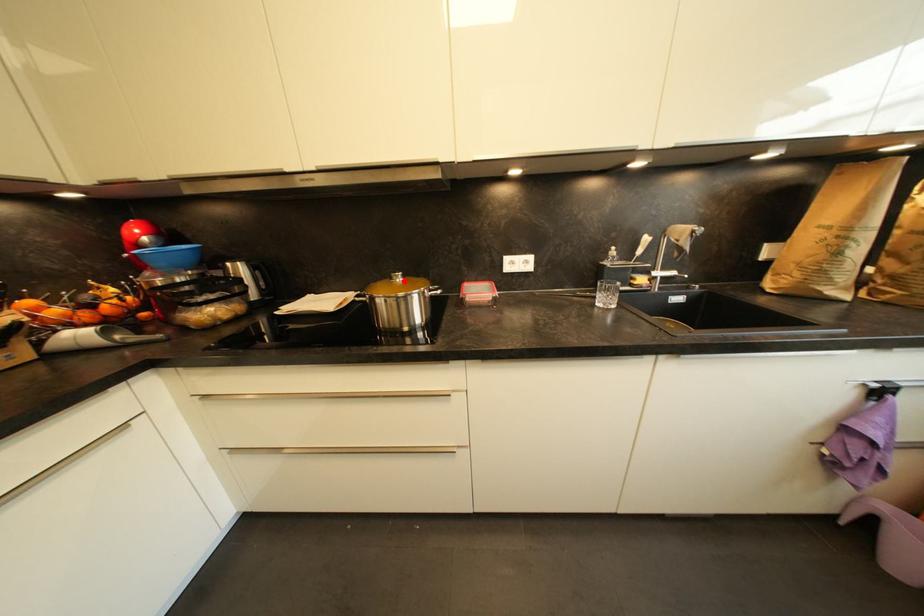
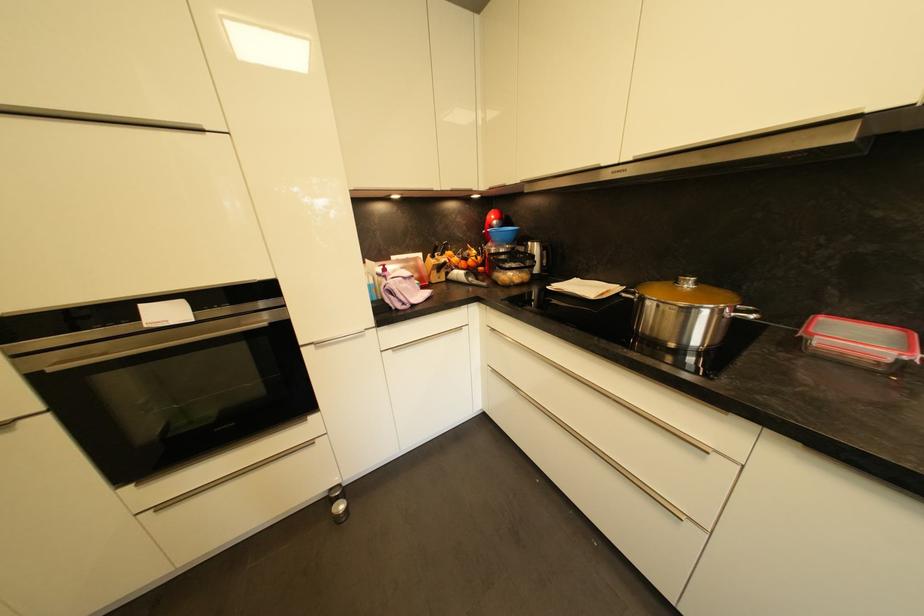
Find the pixel in the second image that matches the highlighted location in the first image.

(694, 286)